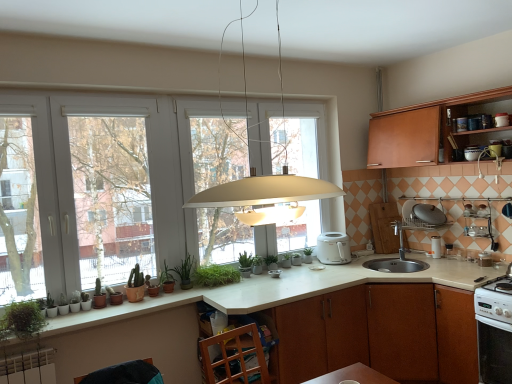
At what (x,y) coordinates should I click in order to perform the action: click on vacant area located to the right-hand side of green matte plant at center, placed as the first plant when sorted from right to left. Please return your answer as a coordinate pair (x, y). The height and width of the screenshot is (384, 512). Looking at the image, I should click on (293, 266).